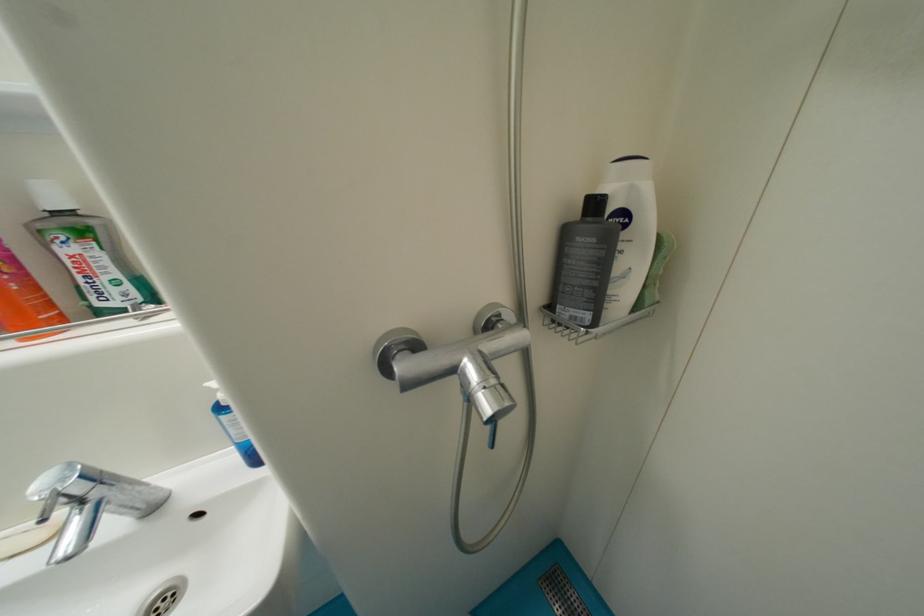
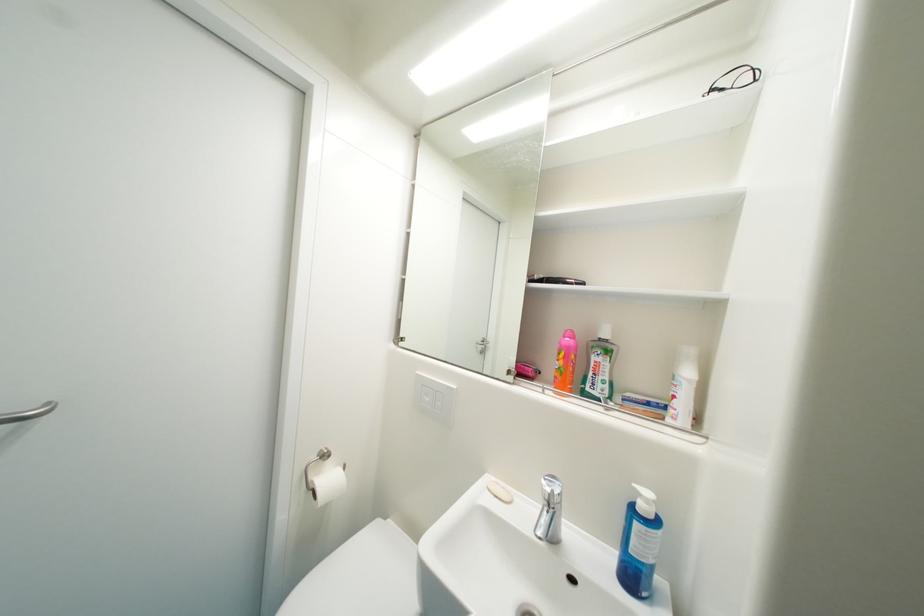
In the second image, find the point that corresponds to point 87,281 in the first image.

(598, 376)